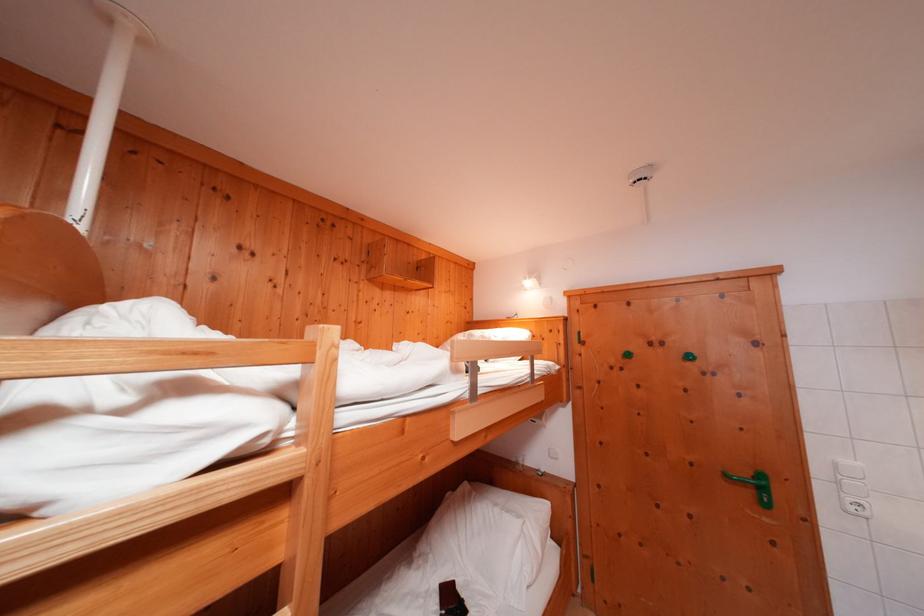
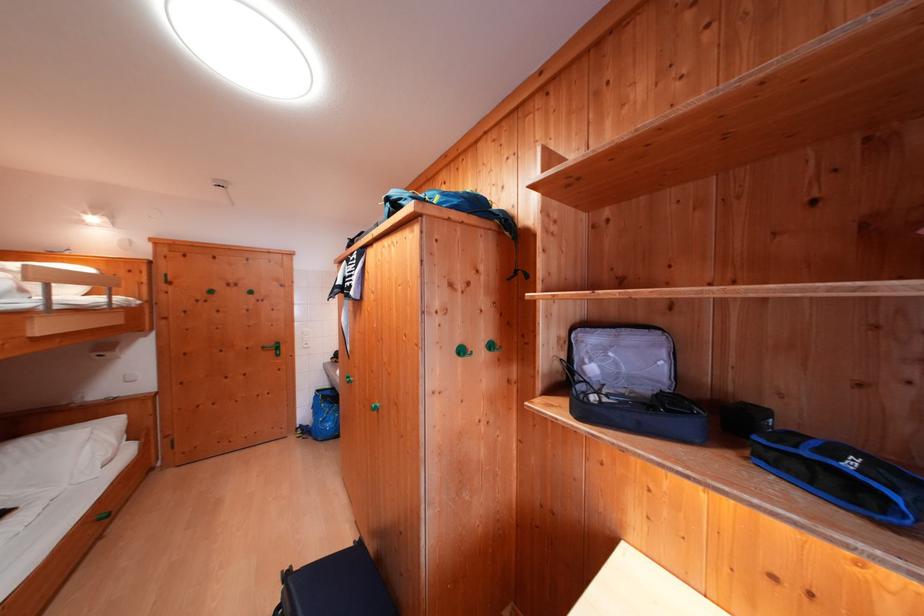
Find the pixel in the second image that matches the point at 755,477 in the first image.

(280, 349)